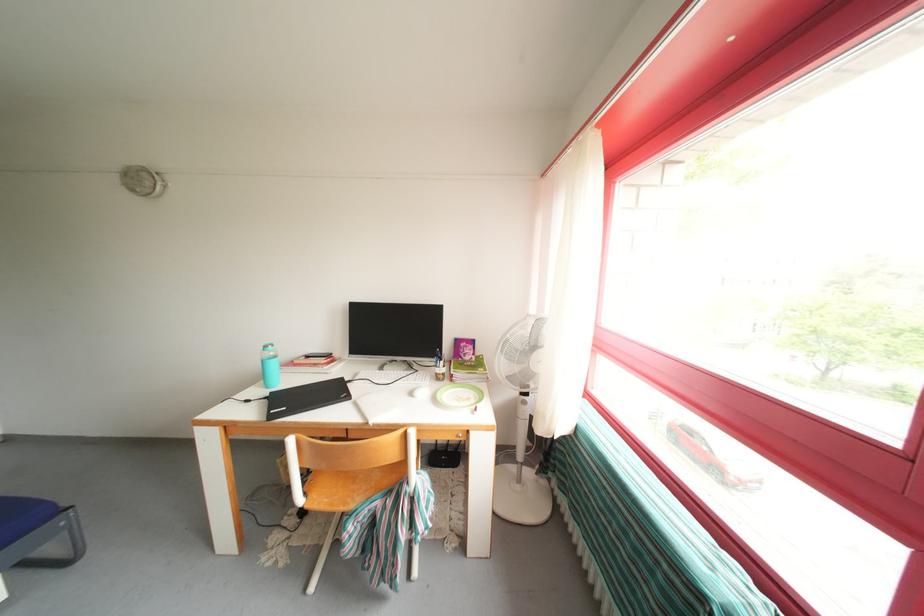
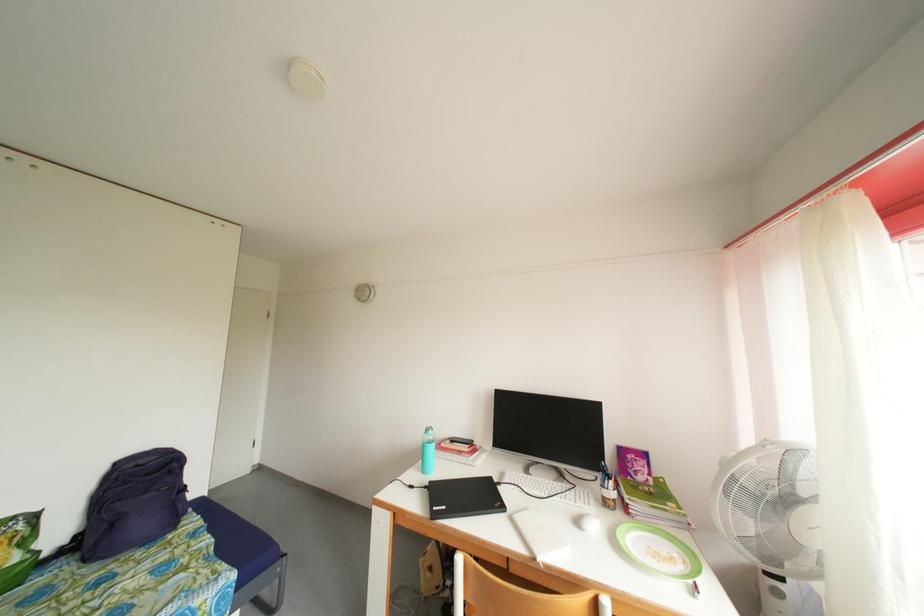
Based on the continuous images, in which direction is the camera rotating?

The rotation direction of the camera is left-up.